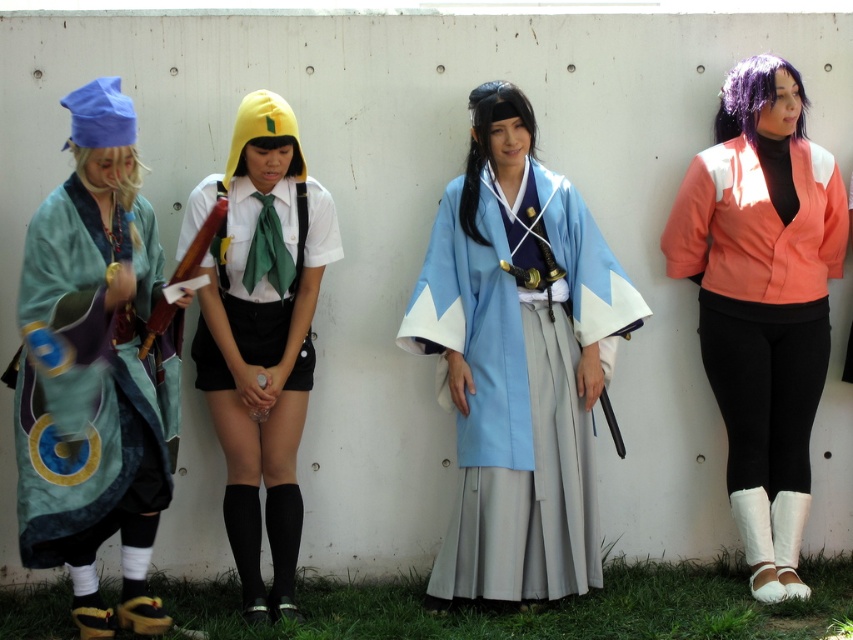
Looking at this image, you are a photographer standing at the location of the camera. You want to take a photo of the orange fabric jacket at right without moving your position. Is the jacket within your camera lens range if the maximum distance your camera can focus is 15 feet?

The orange fabric jacket at right and camera are 14.91 feet apart from each other. Since the distance is less than 15 feet, the jacket is within the camera lens range and can be focused properly.

In the scene described, there are two kimonos present. The light blue silk kimono at center and the teal silk kimono at left. Which kimono is positioned to the right of the other?

The light blue silk kimono at center is positioned to the right of the teal silk kimono at left.